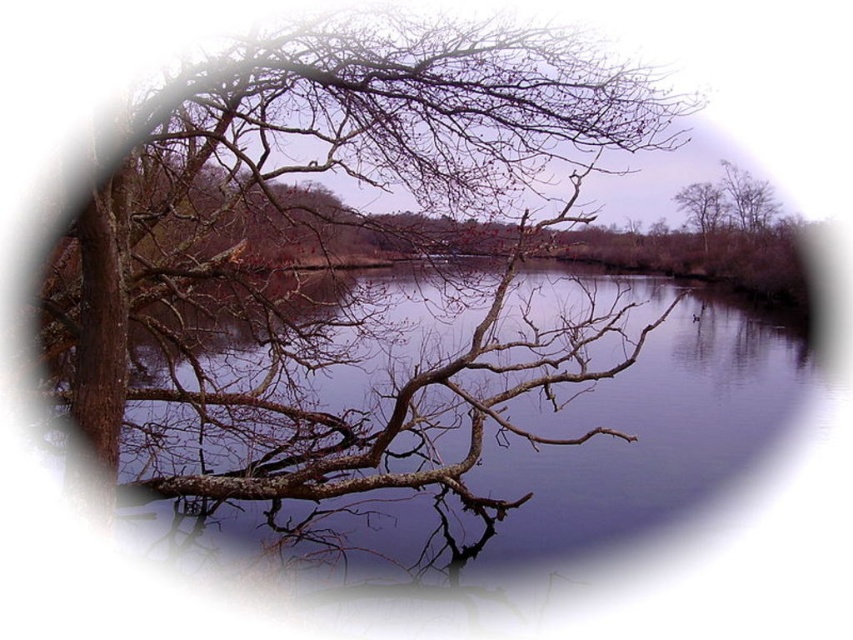
Question: In this image, where is brown rough bark tree at upper left located relative to brown rough tree at upper center?

Choices:
 (A) above
 (B) below

Answer: (B)

Question: Can you confirm if smooth water at center is smaller than brown rough tree at upper center?

Choices:
 (A) no
 (B) yes

Answer: (A)

Question: Which object is positioned closest to the brown rough tree at upper right?

Choices:
 (A) brown rough tree at upper center
 (B) smooth water at center

Answer: (A)

Question: Can you confirm if smooth water at center is positioned above brown rough tree at upper right?

Choices:
 (A) no
 (B) yes

Answer: (A)

Question: Which object is closer to the camera taking this photo?

Choices:
 (A) smooth water at center
 (B) brown rough tree at upper right

Answer: (A)

Question: Considering the real-world distances, which object is closest to the brown rough bark tree at upper left?

Choices:
 (A) brown rough tree at upper center
 (B) brown rough tree at upper right

Answer: (A)